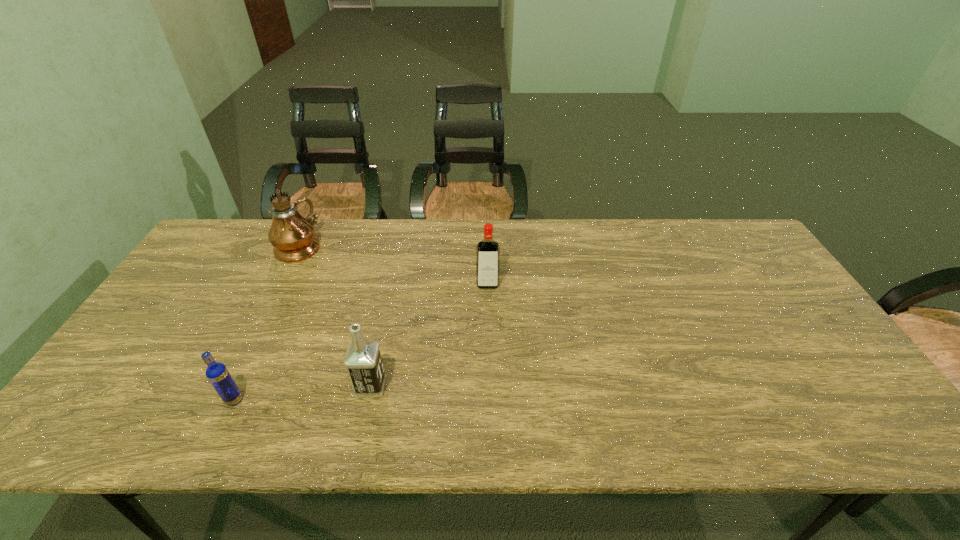
Where is `the tallest object`? the tallest object is located at coordinates (293, 237).

Where is `the farthest object`? This screenshot has height=540, width=960. the farthest object is located at coordinates (293, 237).

Where is `the rightmost object`? This screenshot has width=960, height=540. the rightmost object is located at coordinates (488, 250).

Where is `the second farthest object`? the second farthest object is located at coordinates (488, 250).

This screenshot has width=960, height=540. In order to click on the second vodka from right to left in this screenshot , I will do point(363,361).

The image size is (960, 540). I want to click on the shortest object, so coord(217,373).

Locate an element on the screen. the leftmost vodka is located at coordinates [x=217, y=373].

I want to click on free space located 0.360m on the right of the tallest object, so click(x=430, y=246).

In order to click on vacant area situated 0.150m on the front and back of the rightmost object in this screenshot , I will do point(489,329).

Find the location of a particular element. This screenshot has width=960, height=540. vacant space located 0.320m on the front label of the third object from left to right is located at coordinates (519, 386).